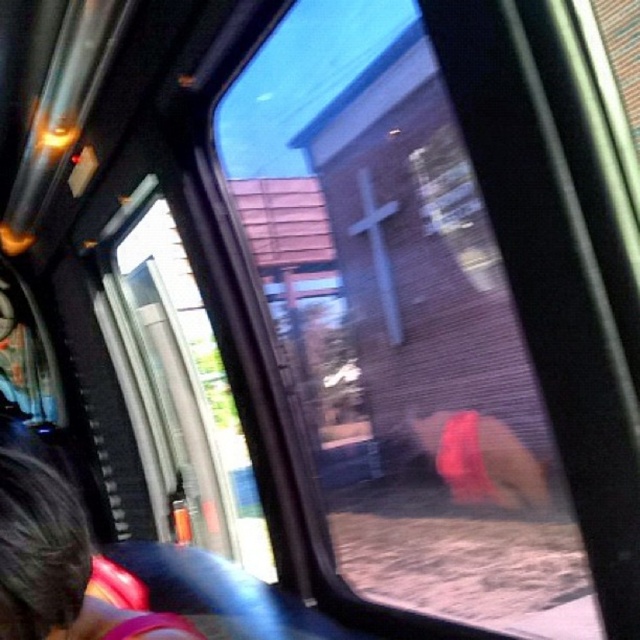
You are a passenger in a moving vehicle and want to see the outside view clearly. The transparent glass window at center and dark brown hair at lower left are in your line of sight. Which object is taller and might block your view more?

The transparent glass window at center has a greater height compared to dark brown hair at lower left, so it might block your view more.

You are a passenger on a bus and want to check your reflection in the transparent glass window at center. However, you notice dark brown hair at lower left in your view. Which object would you need to adjust to ensure you can see your reflection clearly?

The transparent glass window at center is bigger than dark brown hair at lower left, so adjusting the dark brown hair at lower left would allow you to see your reflection clearly as it is smaller and less obstructive.